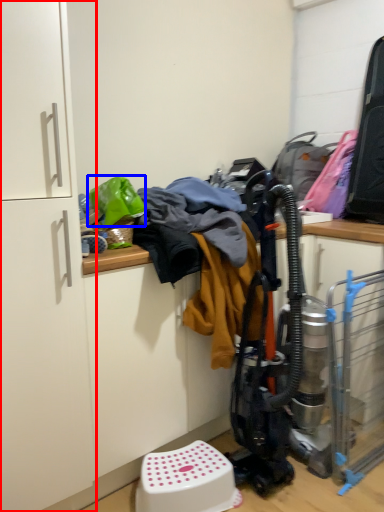
Question: Which point is further to the camera, cabinetry (highlighted by a red box) or clothing (highlighted by a blue box)?

Choices:
 (A) cabinetry
 (B) clothing

Answer: (B)